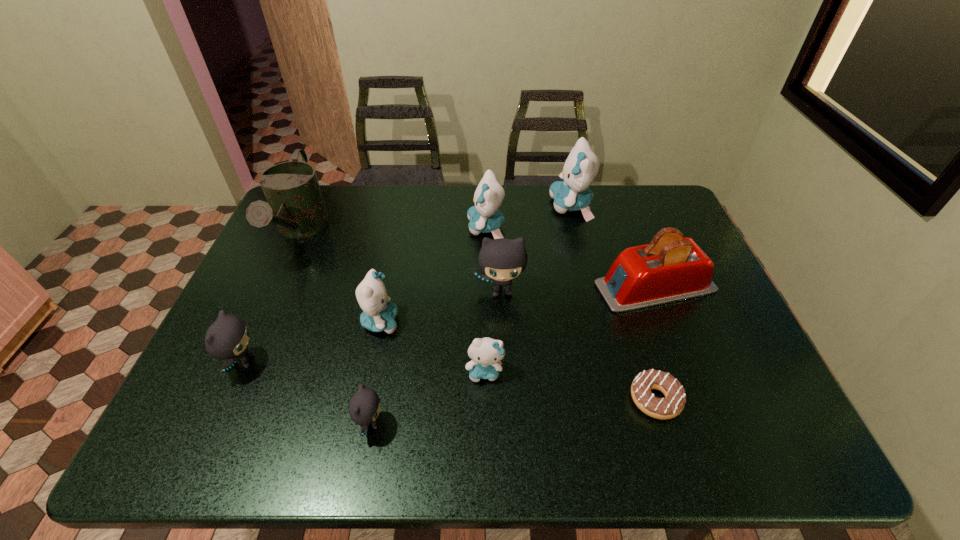
Where is `watering can located at the far edge`? This screenshot has height=540, width=960. watering can located at the far edge is located at coordinates (295, 204).

Find the location of `kitten that is at the near edge`. kitten that is at the near edge is located at coordinates (364, 407).

At what (x,y) coordinates should I click in order to perform the action: click on doughnut at the near edge. Please return your answer as a coordinate pair (x, y). Looking at the image, I should click on (672, 405).

At what (x,y) coordinates should I click in order to perform the action: click on watering can that is at the left edge. Please return your answer as a coordinate pair (x, y). Looking at the image, I should click on (295, 204).

Identify the location of kitten present at the left edge. pos(227,338).

At what (x,y) coordinates should I click in order to perform the action: click on object that is at the right edge. Please return your answer as a coordinate pair (x, y). Image resolution: width=960 pixels, height=540 pixels. Looking at the image, I should click on (671, 268).

The width and height of the screenshot is (960, 540). I want to click on object situated at the far left corner, so click(295, 204).

Find the location of a particular element. Image resolution: width=960 pixels, height=540 pixels. vacant space at the far edge is located at coordinates (542, 194).

The width and height of the screenshot is (960, 540). In the image, there is a desktop. What are the coordinates of `vacant space at the left edge` in the screenshot? It's located at (261, 296).

This screenshot has height=540, width=960. I want to click on blank area at the right edge, so 737,348.